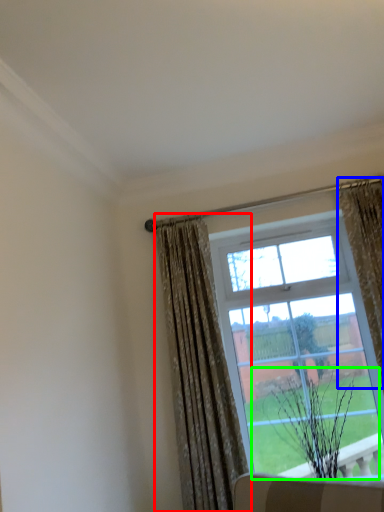
Question: Which is nearer to the curtain (highlighted by a red box)? curtain (highlighted by a blue box) or plant (highlighted by a green box).

Choices:
 (A) curtain
 (B) plant

Answer: (B)